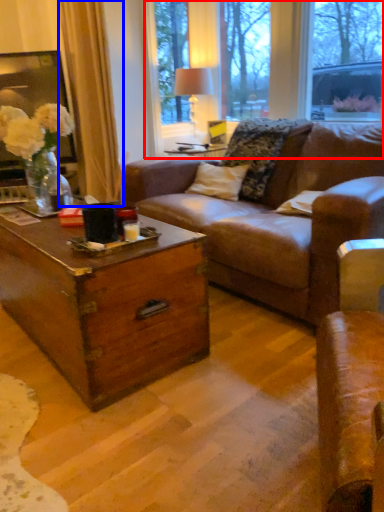
Question: Which point is closer to the camera, bay window (highlighted by a red box) or curtain (highlighted by a blue box)?

Choices:
 (A) bay window
 (B) curtain

Answer: (A)